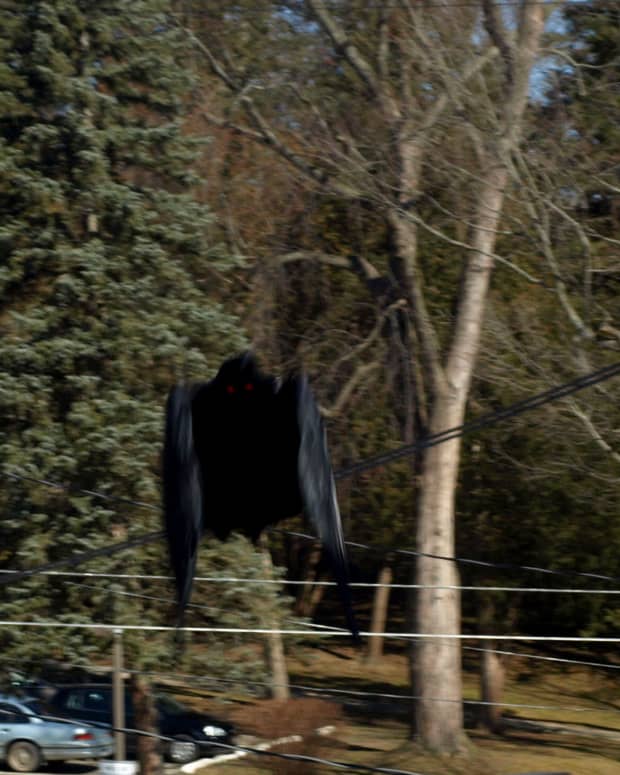
Find the location of a particular element. The height and width of the screenshot is (775, 620). window is located at coordinates (7, 713), (87, 701).